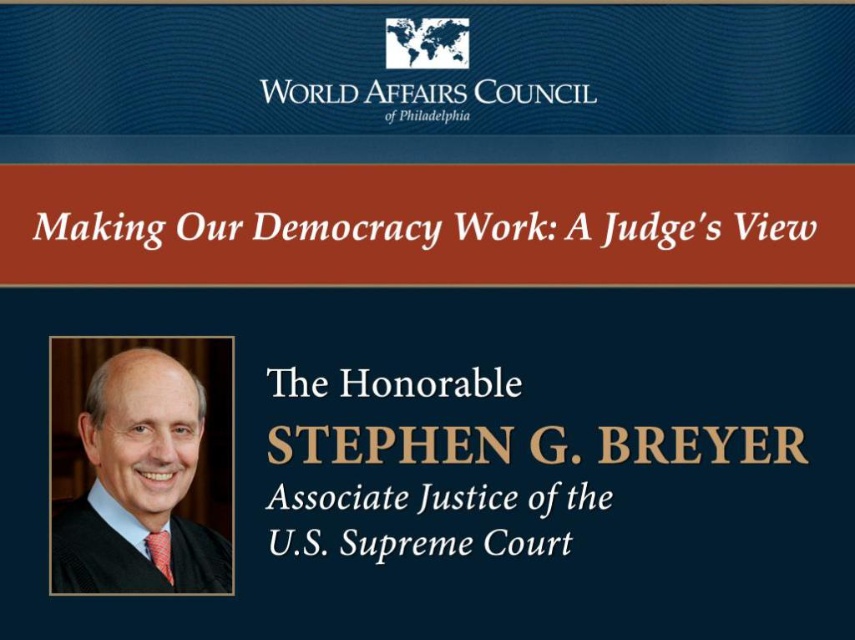
Looking at this image, you are an event planner reviewing the promotional graphic for the World Affairs Council of Philadelphia. You notice a black robe at left in the image. Based on its position at point 0.755, 0.163, can you determine if it is placed near the top or bottom of the image?

The black robe at left is located at point (139,483), which places it near the top of the image since the y coordinate is 0.163, indicating it is closer to the top edge.

You are an attendee at the World Affairs Council of Philadelphia event and you see the black robe at left and the white paper at upper center on the promotional graphic. Which object is located more to the left?

The black robe at left is more to the left than the white paper at upper center.